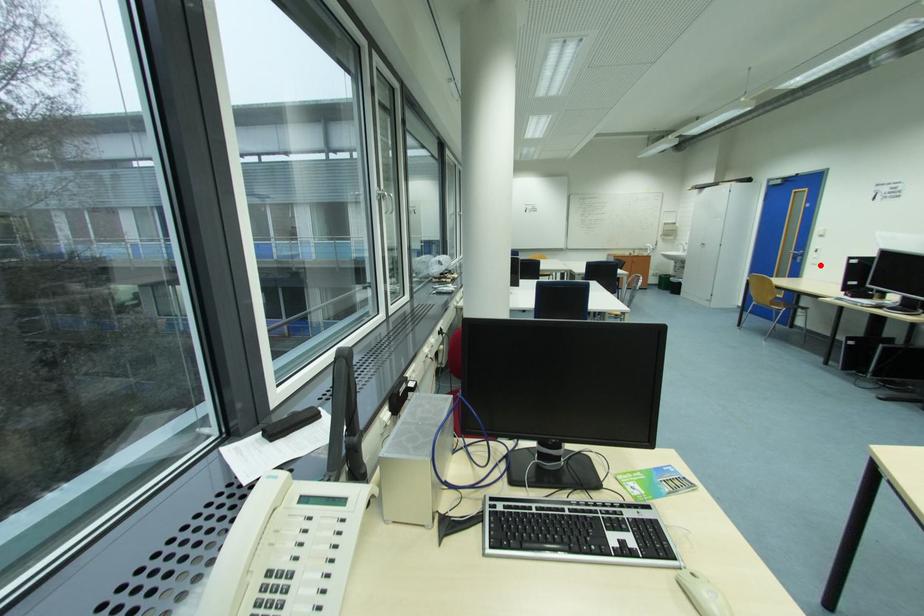
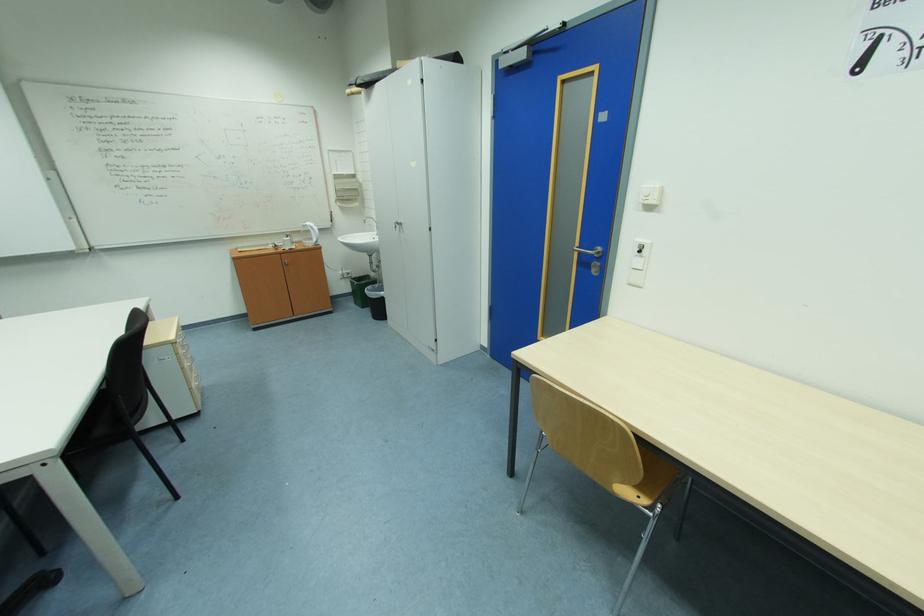
The point at the highlighted location is marked in the first image. Where is the corresponding point in the second image?

(638, 286)